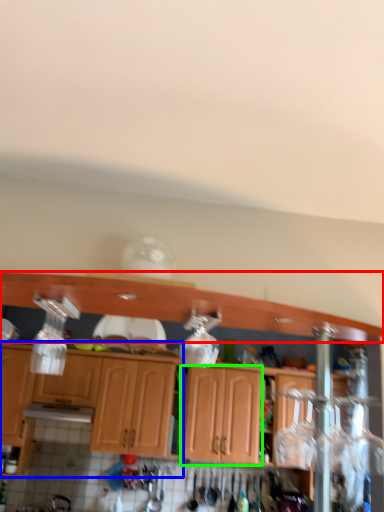
Question: Which is farther away from cabinetry (highlighted by a red box)? cabinetry (highlighted by a blue box) or cabinetry (highlighted by a green box)?

Choices:
 (A) cabinetry
 (B) cabinetry

Answer: (B)